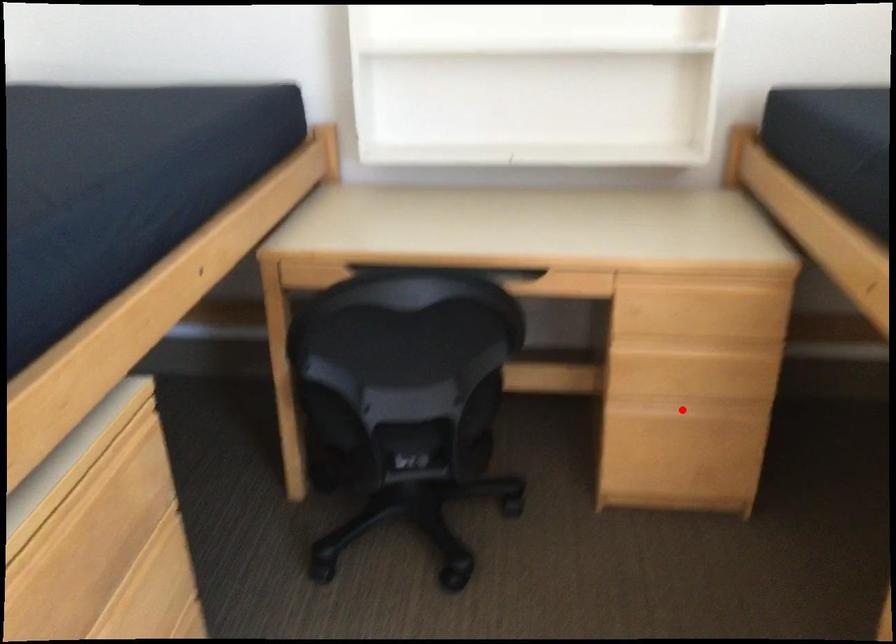
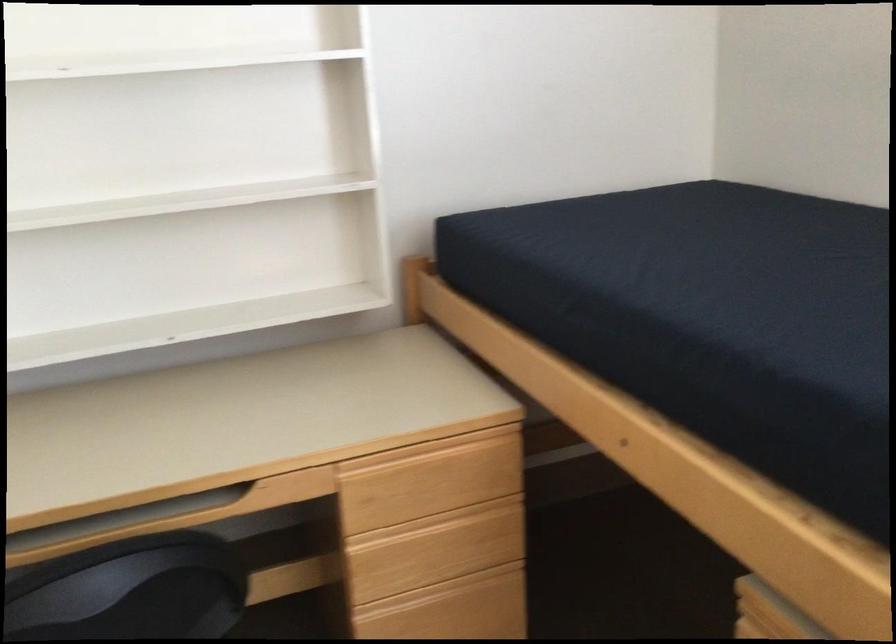
Locate, in the second image, the point that corresponds to the highlighted location in the first image.

(442, 592)